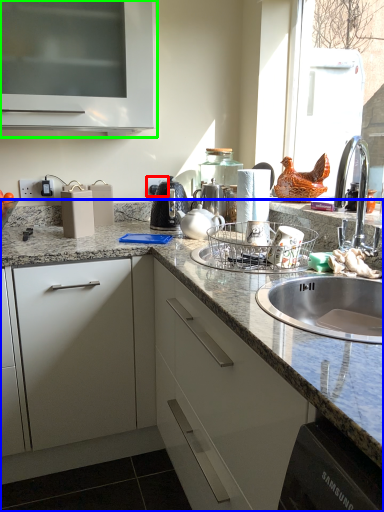
Question: Which is farther away from electric outlet (highlighted by a red box)? countertop (highlighted by a blue box) or cabinetry (highlighted by a green box)?

Choices:
 (A) countertop
 (B) cabinetry

Answer: (A)